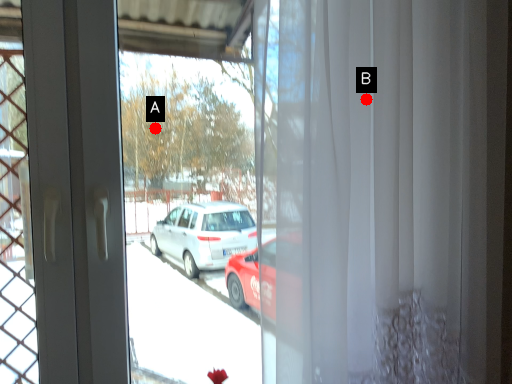
Question: Two points are circled on the image, labeled by A and B beside each circle. Which point is closer to the camera?

Choices:
 (A) A is closer
 (B) B is closer

Answer: (B)